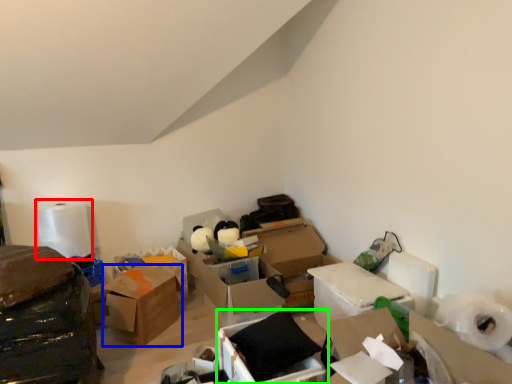
Question: Which object is positioned closest to toilet paper (highlighted by a red box)? Select from box (highlighted by a blue box) and box (highlighted by a green box).

Choices:
 (A) box
 (B) box

Answer: (A)